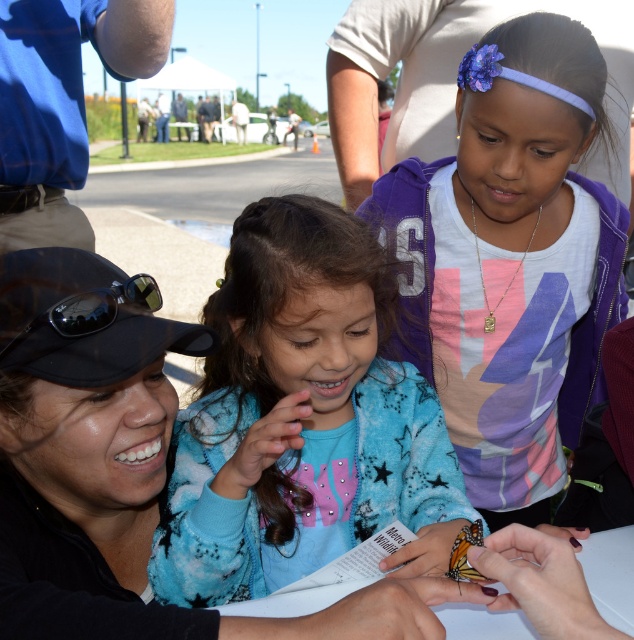
Question: Is blue fleece jacket at center further to camera compared to white cotton shirt at upper center?

Choices:
 (A) yes
 (B) no

Answer: (B)

Question: Does purple cotton hoodie at upper right appear under white cotton shirt at upper center?

Choices:
 (A) no
 (B) yes

Answer: (B)

Question: Which is nearer to the white cotton shirt at upper center?

Choices:
 (A) blue fleece jacket at center
 (B) purple cotton hoodie at upper right
 (C) blue shirt at upper left

Answer: (B)

Question: Which point appears farthest from the camera in this image?

Choices:
 (A) (571, 291)
 (B) (10, 125)
 (C) (385, 65)

Answer: (C)

Question: Which of the following is the closest to the observer?

Choices:
 (A) (618, 301)
 (B) (427, 488)

Answer: (B)

Question: Does blue fleece jacket at center appear over white cotton shirt at upper center?

Choices:
 (A) yes
 (B) no

Answer: (B)